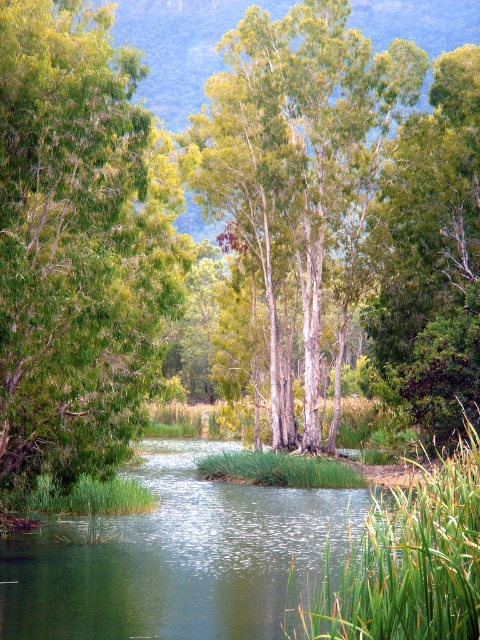
Is green smooth tree at center positioned at the back of green leafy tree at upper center?

Yes, green smooth tree at center is behind green leafy tree at upper center.

Based on the photo, does green smooth tree at center appear over green leafy tree at upper center?

Indeed, green smooth tree at center is positioned over green leafy tree at upper center.

Is point (192, 180) positioned before point (387, 298)?

Yes, point (192, 180) is closer to viewer.

What are the coordinates of `green smooth tree at center` in the screenshot? It's located at (297, 161).

How far apart are green leafy tree at left and green leafy tree at upper center?

The distance of green leafy tree at left from green leafy tree at upper center is 12.70 meters.

From the picture: Can you confirm if green leafy tree at left is positioned above green leafy tree at upper center?

Yes.

Who is more distant from viewer, (68, 195) or (421, 176)?

Point (421, 176)

Where is `green leafy tree at left`? green leafy tree at left is located at coordinates (79, 243).

Between green leafy tree at left and green smooth tree at center, which one is positioned higher?

green smooth tree at center is higher up.

Which is behind, point (111, 461) or point (300, 273)?

Positioned behind is point (300, 273).

Who is more forward, (48, 256) or (273, 28)?

Point (48, 256) is more forward.

In order to click on green leafy tree at left in this screenshot , I will do `click(79, 243)`.